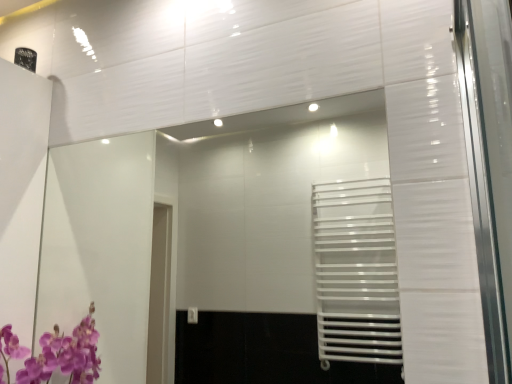
The height and width of the screenshot is (384, 512). What do you see at coordinates (54, 355) in the screenshot?
I see `purple matte flower at lower left` at bounding box center [54, 355].

Identify the location of purple matte flower at lower left. (54, 355).

This screenshot has width=512, height=384. Find the location of `purple matte flower at lower left`. purple matte flower at lower left is located at coordinates (54, 355).